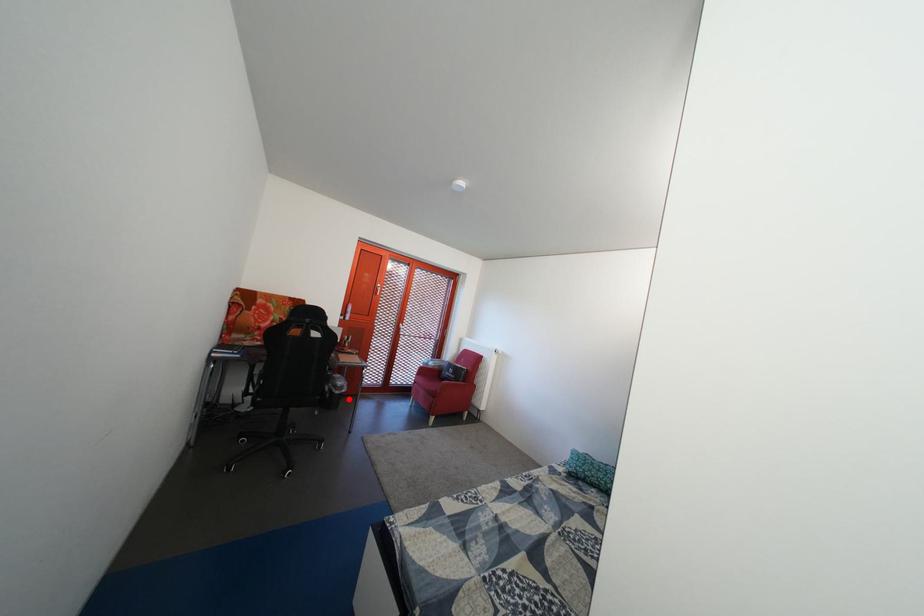
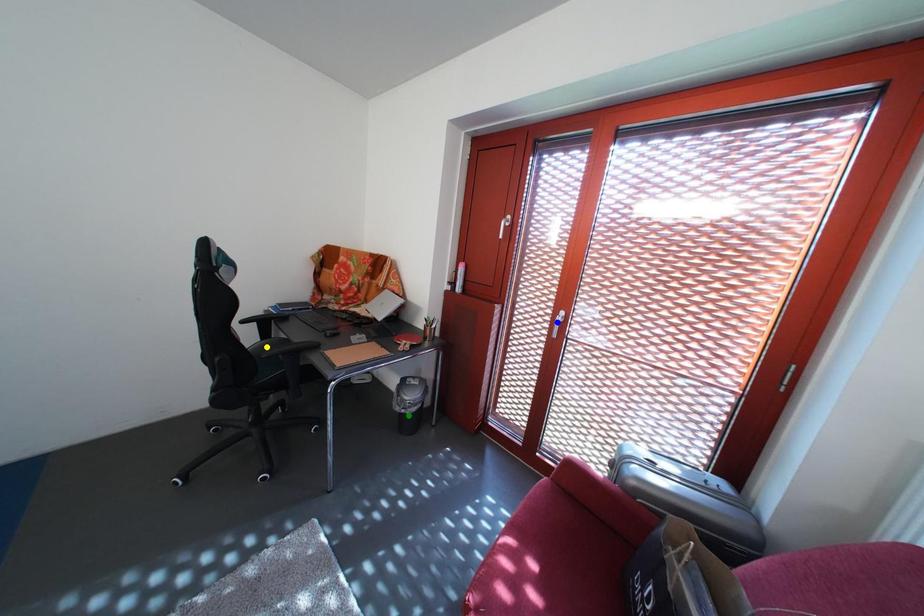
Question: I am providing you with two images of the same scene from different viewpoints. A red point is marked on the first image. You are given multiple points on the second image. In image 2, which mark is for the same physical point as the one in image 1?

Choices:
 (A) yellow point
 (B) blue point
 (C) green point

Answer: (C)